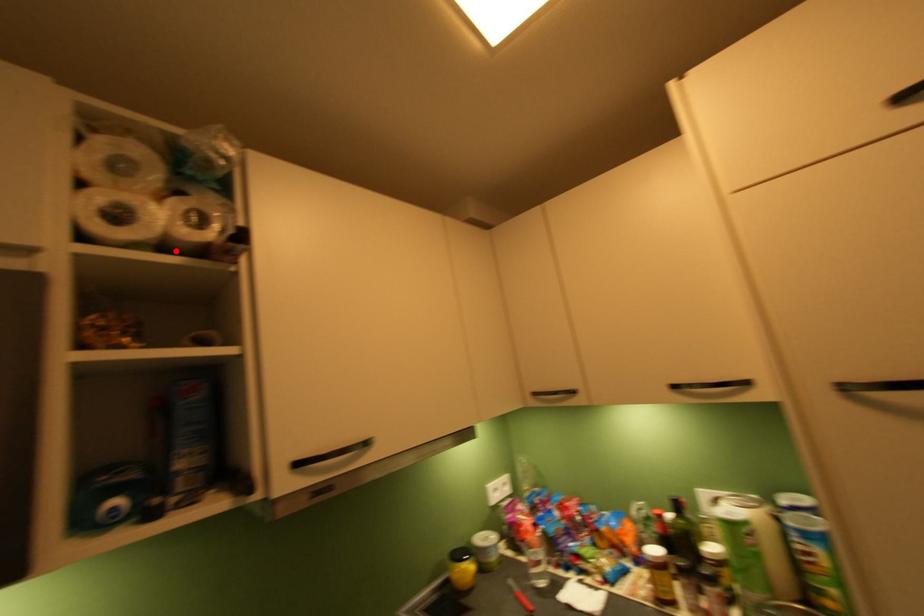
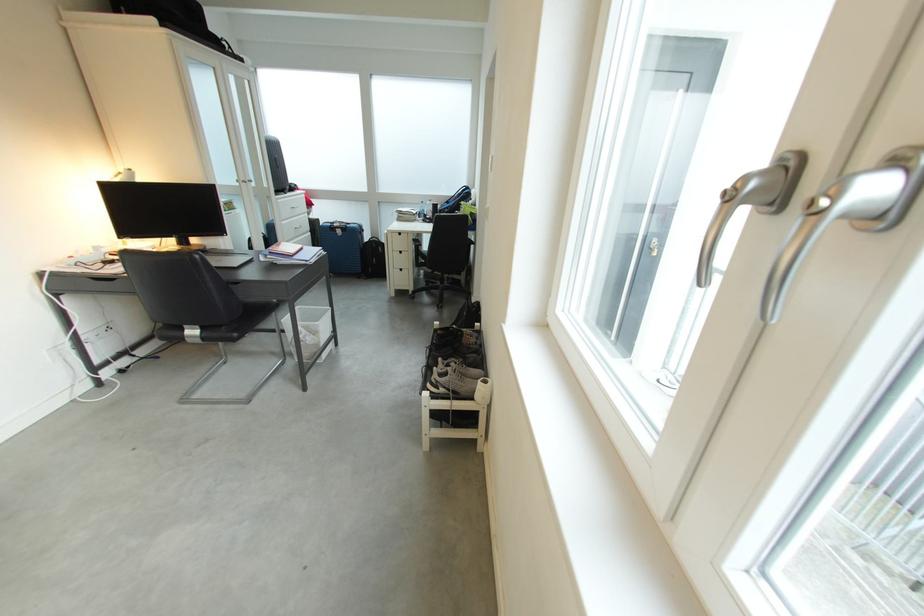
Question: I am providing you with two images of the same scene from different viewpoints. A red point is marked on the first image. At the location where the point appears in image 1, is it still visible in image 2?

Choices:
 (A) Yes
 (B) No

Answer: (B)